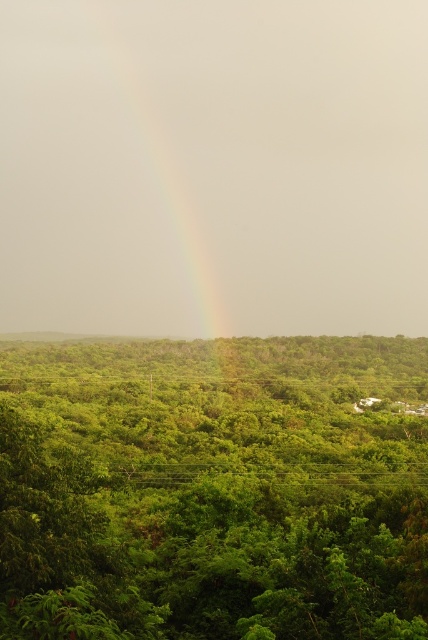
Between green leafy tree at center and rainbow at center, which one appears on the left side from the viewer's perspective?

From the viewer's perspective, rainbow at center appears more on the left side.

From the picture: Does green leafy tree at center have a lesser width compared to rainbow at center?

No.

Measure the distance between point (279, 422) and camera.

129.10 meters

The image size is (428, 640). I want to click on green leafy tree at center, so click(214, 490).